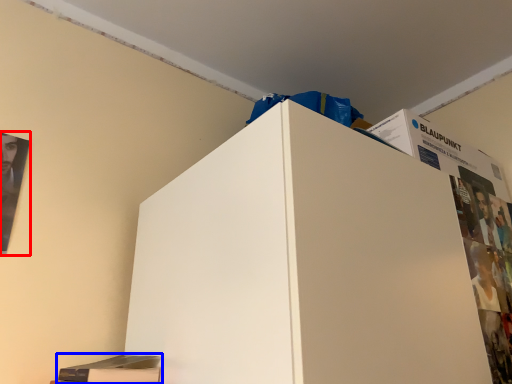
Question: Which point is further to the camera, poster page (highlighted by a red box) or magazine (highlighted by a blue box)?

Choices:
 (A) poster page
 (B) magazine

Answer: (A)